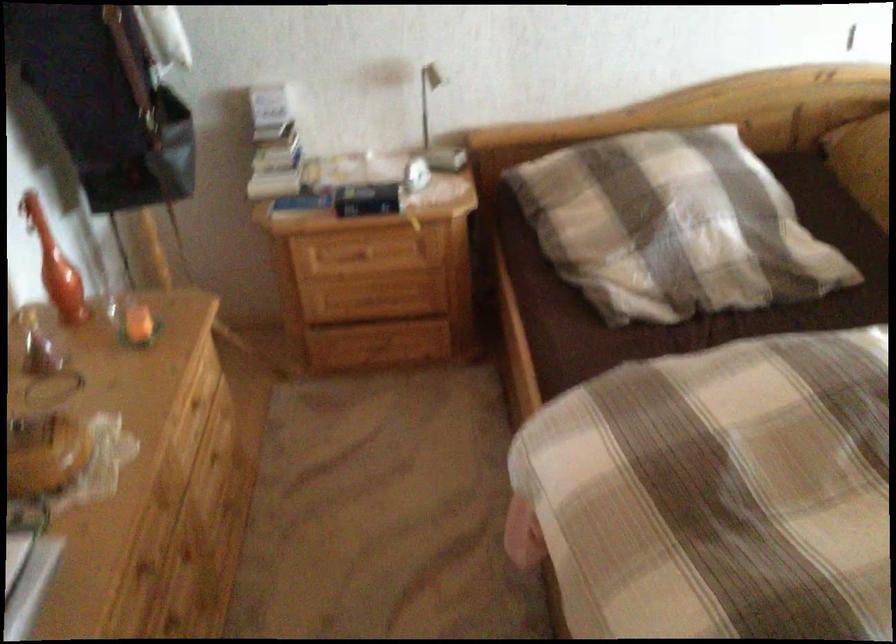
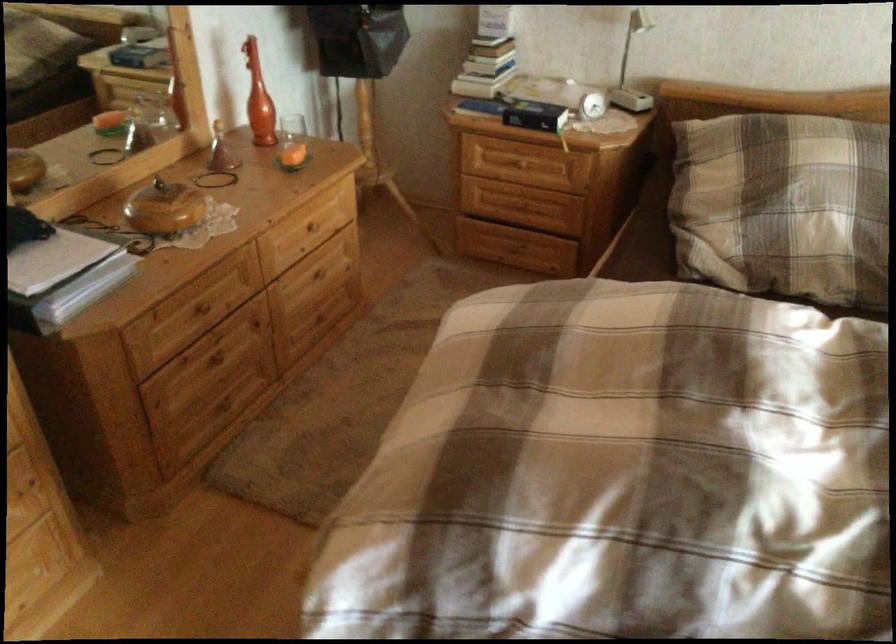
In the second image, find the point that corresponds to point (373, 202) in the first image.

(535, 115)